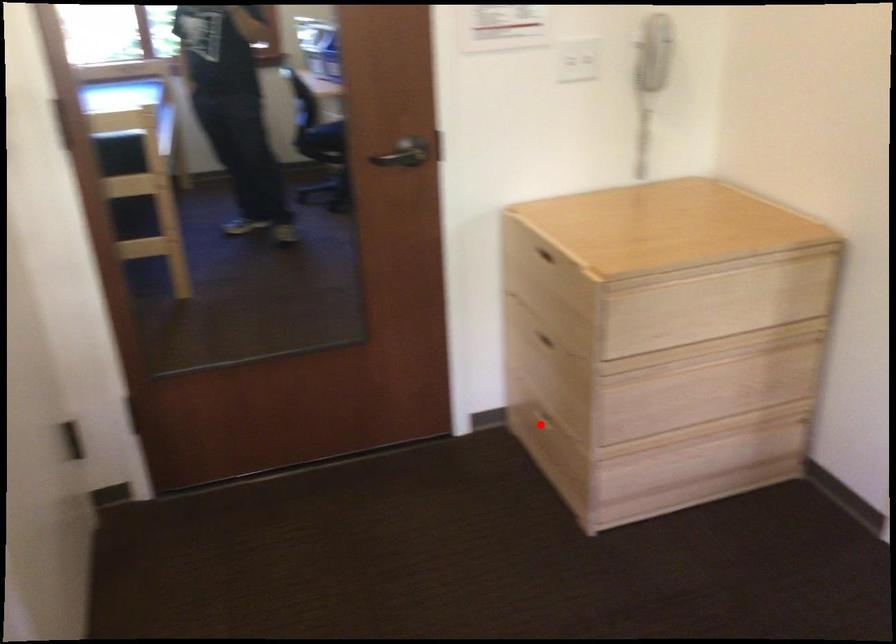
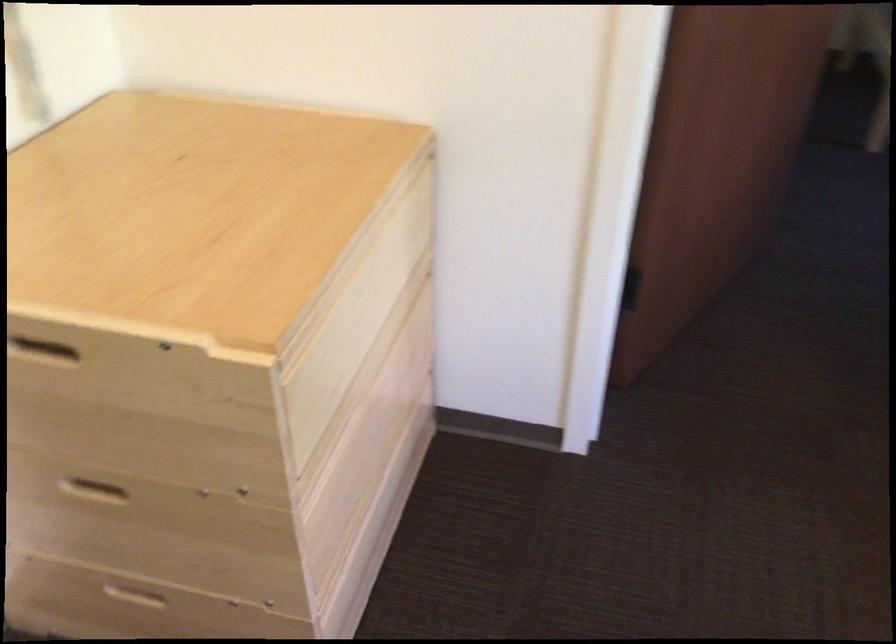
The point at the highlighted location is marked in the first image. Where is the corresponding point in the second image?

(135, 600)